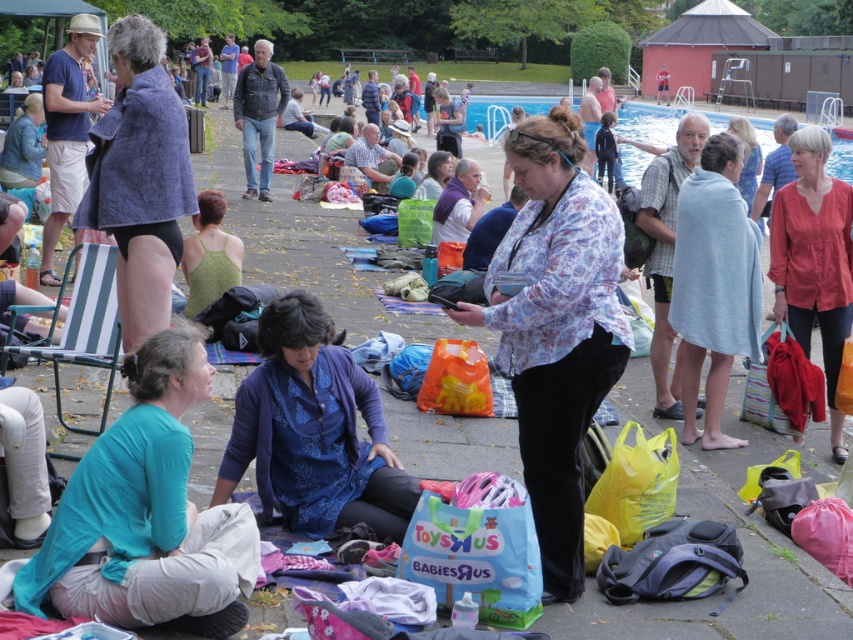
Question: Which of the following is the closest to the observer?

Choices:
 (A) tap(431, 564)
 (B) tap(477, 193)

Answer: (A)

Question: Is red cotton shirt at right above blue fabric shirt at center?

Choices:
 (A) yes
 (B) no

Answer: (B)

Question: Which of the following is the farthest from the observer?

Choices:
 (A) (492, 188)
 (B) (753, 168)
 (C) (199, 586)

Answer: (A)

Question: Which object appears farthest from the camera in this image?

Choices:
 (A) red cotton shirt at right
 (B) blue floral blouse at center
 (C) blue smooth water at upper center
 (D) floral fabric shirt at center

Answer: (C)

Question: Where is blue smooth water at upper center located in relation to matte blue dress at center in the image?

Choices:
 (A) above
 (B) below

Answer: (A)

Question: Is floral print blouse at center bigger than teal fabric shirt at lower left?

Choices:
 (A) yes
 (B) no

Answer: (A)